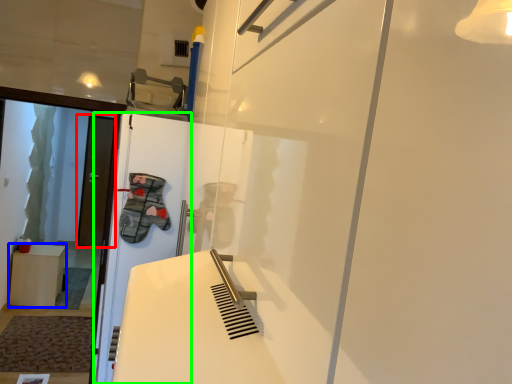
Question: Which is farther away from door (highlighted by a red box)? furniture (highlighted by a blue box) or screen door (highlighted by a green box)?

Choices:
 (A) furniture
 (B) screen door

Answer: (B)